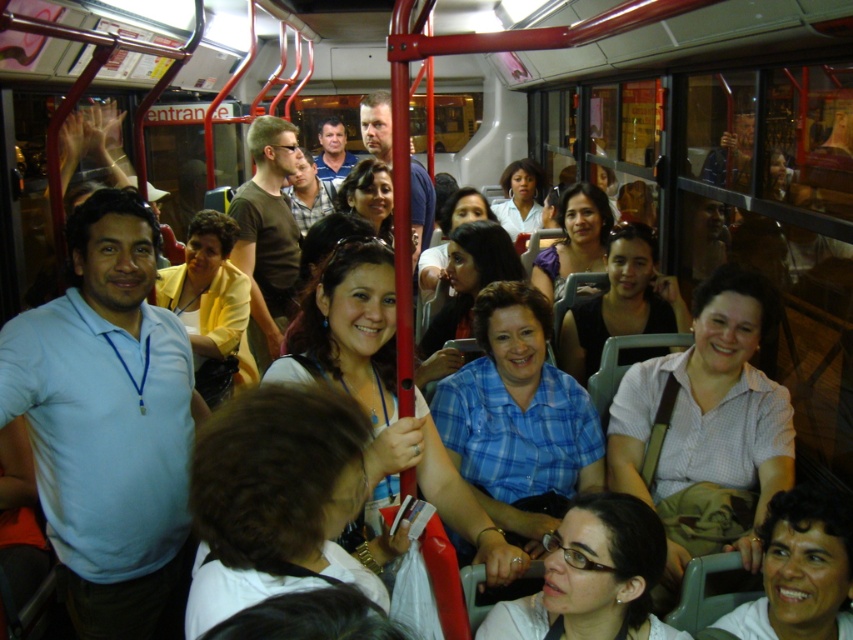
Question: Which object appears closest to the camera in this image?

Choices:
 (A) dark brown hair at center
 (B) matte white shirt at lower center
 (C) light blue cotton shirt at center

Answer: (A)

Question: Is the position of light blue cotton shirt at center less distant than that of white checkered shirt at center?

Choices:
 (A) yes
 (B) no

Answer: (A)

Question: Which of the following is the farthest from the observer?

Choices:
 (A) matte white shirt at lower center
 (B) white checkered shirt at center
 (C) smooth skin face at lower right
 (D) dark brown hair at center

Answer: (B)

Question: Is dark brown hair at center to the right of matte white shirt at lower center from the viewer's perspective?

Choices:
 (A) yes
 (B) no

Answer: (B)

Question: Is white checkered shirt at center in front of dark brown hair at center?

Choices:
 (A) yes
 (B) no

Answer: (B)

Question: Which of these objects is positioned farthest from the smooth skin face at lower right?

Choices:
 (A) blue plaid shirt at center
 (B) white checkered shirt at center

Answer: (A)